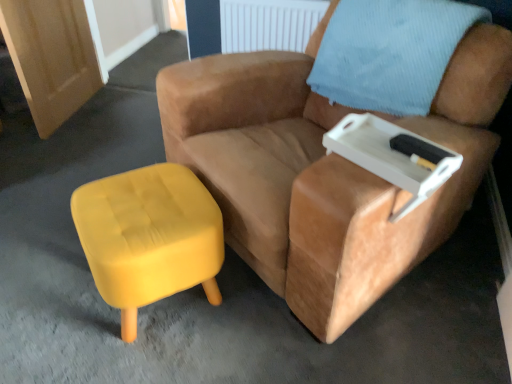
Question: Based on their positions, is light blue textured pillow at upper right located to the left or right of white plastic tray at upper right?

Choices:
 (A) right
 (B) left

Answer: (A)

Question: Is light blue textured pillow at upper right spatially inside white plastic tray at upper right, or outside of it?

Choices:
 (A) inside
 (B) outside

Answer: (B)

Question: Based on their relative distances, which object is farther from the light blue textured pillow at upper right?

Choices:
 (A) yellow fabric stool at lower left
 (B) suede tan armchair at center
 (C) white plastic tray at upper right

Answer: (A)

Question: Which of these objects is positioned farthest from the suede tan armchair at center?

Choices:
 (A) yellow fabric stool at lower left
 (B) light blue textured pillow at upper right
 (C) white plastic tray at upper right

Answer: (A)